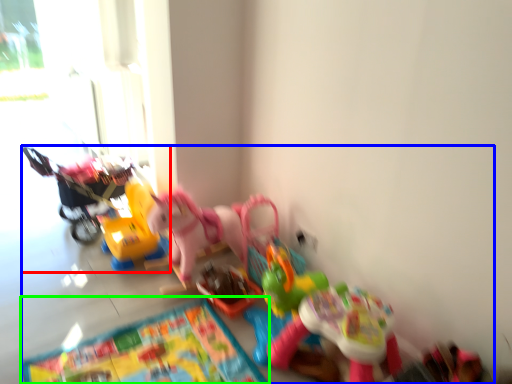
Question: Which object is the farthest from toy (highlighted by a red box)? Choose among these: toy (highlighted by a blue box) or mat (highlighted by a green box).

Choices:
 (A) toy
 (B) mat

Answer: (B)